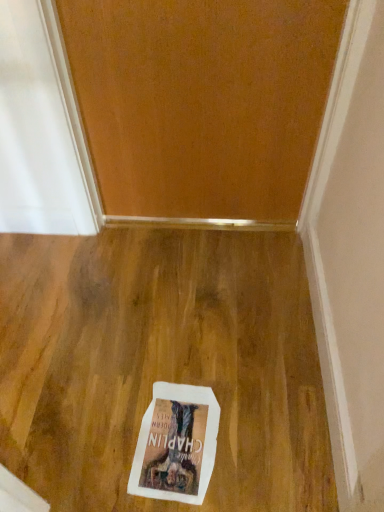
Question: From the image's perspective, relative to wooden door at upper center, is white paper postcard at center above or below?

Choices:
 (A) below
 (B) above

Answer: (A)

Question: In terms of width, does white paper postcard at center look wider or thinner when compared to wooden door at upper center?

Choices:
 (A) thin
 (B) wide

Answer: (B)

Question: Is white paper postcard at center inside or outside of wooden door at upper center?

Choices:
 (A) outside
 (B) inside

Answer: (A)

Question: Based on their sizes in the image, would you say wooden door at upper center is bigger or smaller than white paper postcard at center?

Choices:
 (A) big
 (B) small

Answer: (A)

Question: From the image's perspective, is wooden door at upper center located above or below white paper postcard at center?

Choices:
 (A) above
 (B) below

Answer: (A)

Question: Is wooden door at upper center spatially inside white paper postcard at center, or outside of it?

Choices:
 (A) outside
 (B) inside

Answer: (A)

Question: Relative to white paper postcard at center, is wooden door at upper center in front or behind?

Choices:
 (A) front
 (B) behind

Answer: (A)